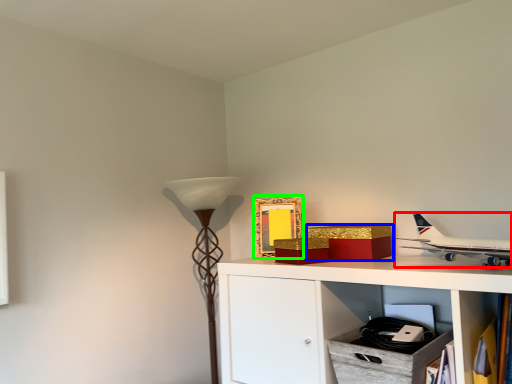
Question: Which object is the closest to the airplane (highlighted by a red box)? Choose among these: box (highlighted by a blue box) or picture frame (highlighted by a green box).

Choices:
 (A) box
 (B) picture frame

Answer: (A)